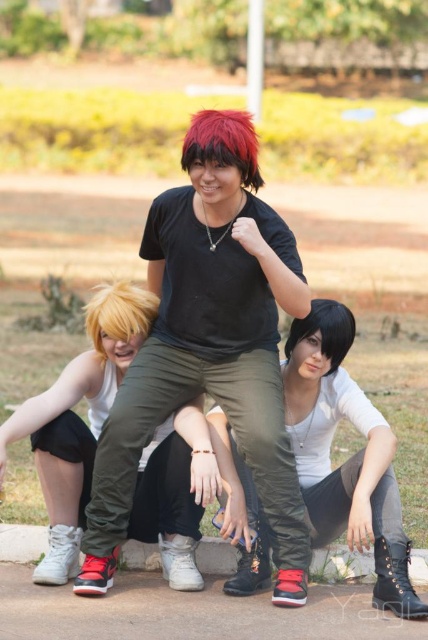
Looking at this image, you are a photographer trying to capture both the shiny red wig at center and the black matte wig at center in a single frame. Which wig should you adjust your camera to focus on first if you want to ensure both are in the frame without moving the camera?

The shiny red wig at center is to the left of the black matte wig at center. Since they are both at the center, you can focus on either one first as they are positioned closely together. However, to ensure both are in frame, center your focus between them.

You are a photographer trying to capture a closeup shot of the shiny red wig at center and the matte black shirt at center. Given that your camera lens can focus on objects within a 4 feet range, will you be able to capture both subjects in focus simultaneously?

The matte black shirt at center and shiny red wig at center are 4.81 feet apart from each other. Since the camera lens can only focus within a 4 feet range, the distance between them exceeds this limit. Therefore, both subjects cannot be in focus at the same time.